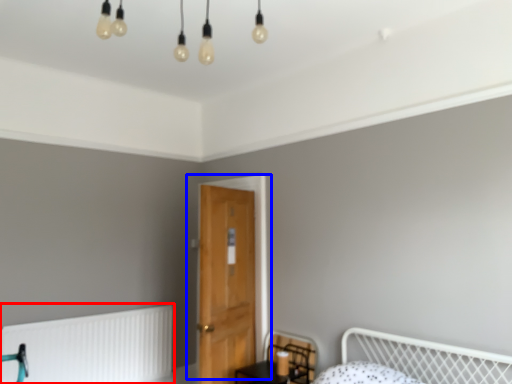
Question: Which point is closer to the camera, radiator (highlighted by a red box) or door (highlighted by a blue box)?

Choices:
 (A) radiator
 (B) door

Answer: (B)